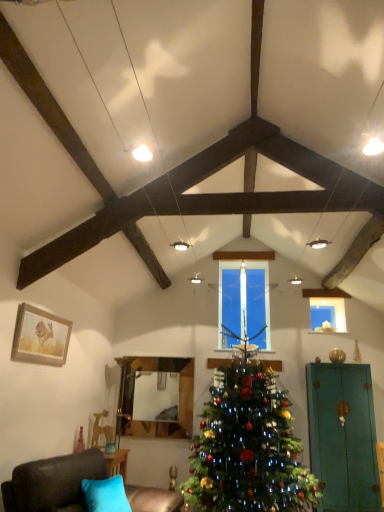
Question: Looking at their shapes, would you say teal matte armoire at right is wider or thinner than clear glass candle at center?

Choices:
 (A) wide
 (B) thin

Answer: (A)

Question: Based on their sizes in the image, would you say teal matte armoire at right is bigger or smaller than clear glass candle at center?

Choices:
 (A) big
 (B) small

Answer: (A)

Question: Which object is positioned closest to the dark brown leather couch at lower left?

Choices:
 (A) green matte christmas tree at center
 (B) transparent glass candle at upper center
 (C) teal matte armoire at right
 (D) clear glass candle at center
 (E) wooden framed picture at left

Answer: (E)

Question: Considering the real-world distances, which object is farthest from the wooden framed picture at left?

Choices:
 (A) clear glass candle at center
 (B) transparent glass candle at upper center
 (C) green matte christmas tree at center
 (D) dark brown leather couch at lower left
 (E) teal matte armoire at right

Answer: (E)